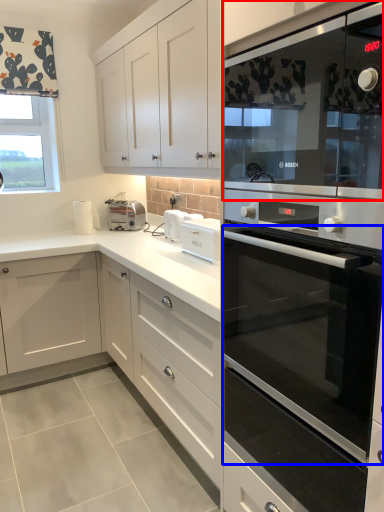
Question: Which object appears farthest to the camera in this image, microwave oven (highlighted by a red box) or oven (highlighted by a blue box)?

Choices:
 (A) microwave oven
 (B) oven

Answer: (B)